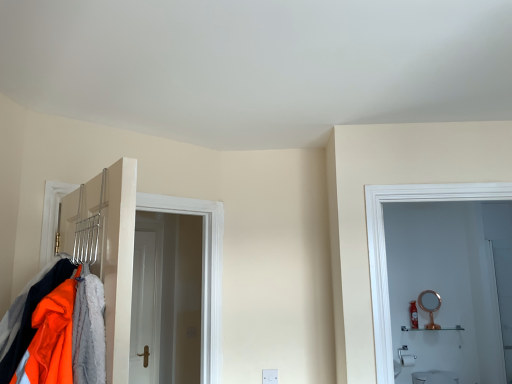
Question: Is white glossy shelf at right taller or shorter than rose gold metallic mirror at right?

Choices:
 (A) tall
 (B) short

Answer: (B)

Question: From a real-world perspective, relative to rose gold metallic mirror at right, is white glossy shelf at right vertically above or below?

Choices:
 (A) below
 (B) above

Answer: (A)

Question: Estimate the real-world distances between objects in this image. Which object is closer to the rose gold metallic mirror at right?

Choices:
 (A) white glossy shelf at right
 (B) metallic silver coat rack at left

Answer: (A)

Question: Estimate the real-world distances between objects in this image. Which object is closer to the metallic silver coat rack at left?

Choices:
 (A) rose gold metallic mirror at right
 (B) white glossy shelf at right

Answer: (B)